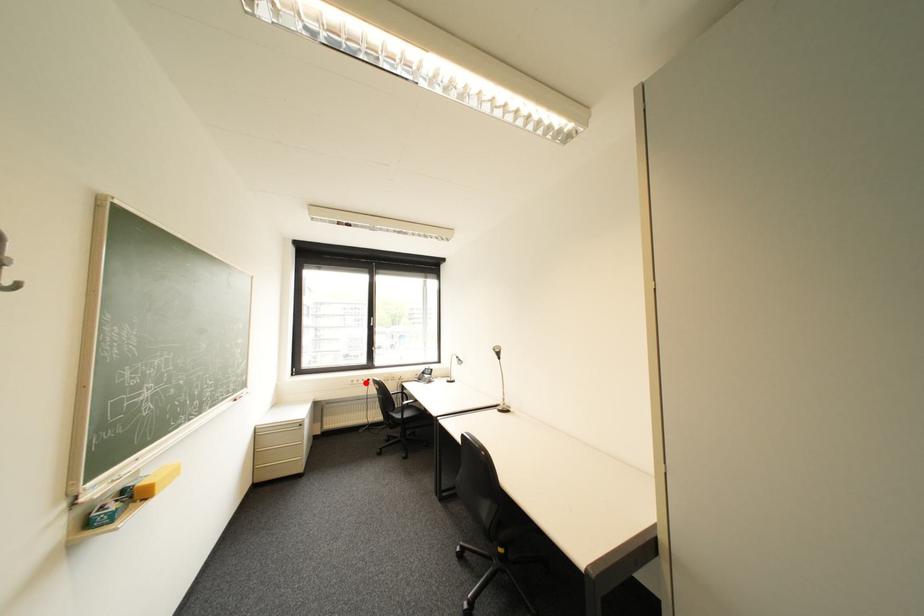
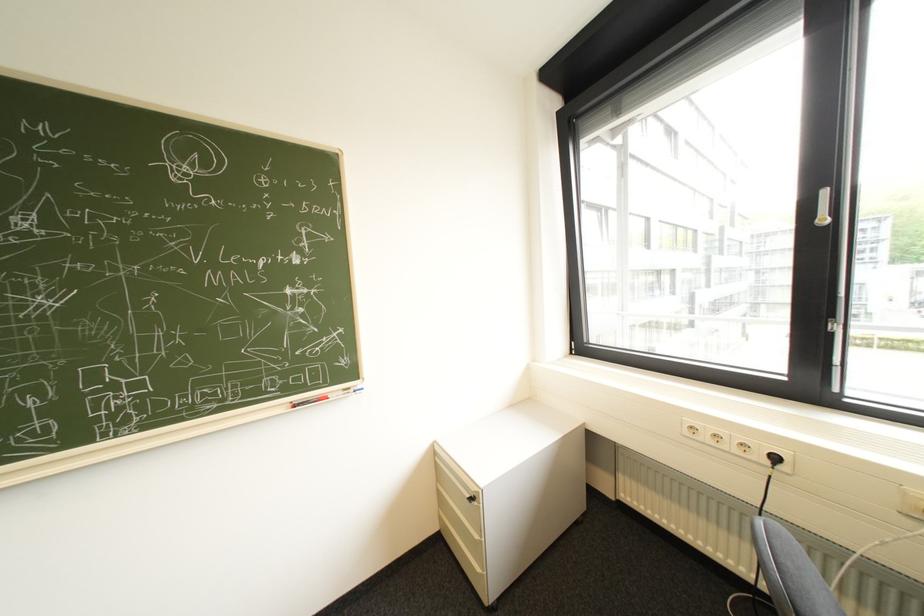
Question: I am providing you with two images of the same scene from different viewpoints. A red point is shown in image1. For the corresponding object point in image2, is it positioned nearer or farther from the camera?

Choices:
 (A) Nearer
 (B) Farther

Answer: (A)